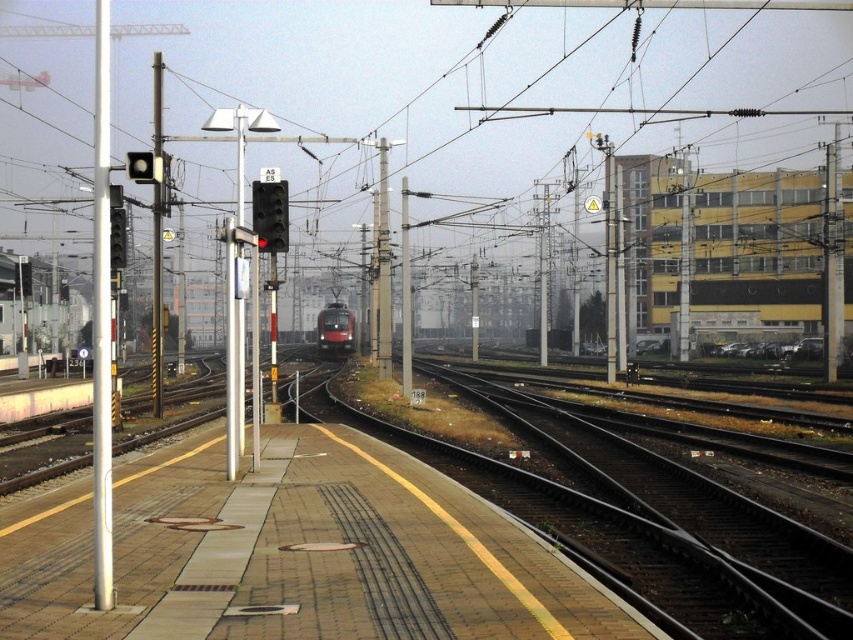
The height and width of the screenshot is (640, 853). I want to click on brick platform at center, so click(294, 554).

Is brick platform at center taller than metallic pole at center?

No.

This screenshot has width=853, height=640. I want to click on brick platform at center, so click(294, 554).

Is brick platform at center thinner than white metallic pole at left?

Indeed, brick platform at center has a lesser width compared to white metallic pole at left.

Between point (315, 538) and point (96, 564), which one is positioned behind?

The point (315, 538) is behind.

This screenshot has height=640, width=853. What do you see at coordinates (294, 554) in the screenshot? I see `brick platform at center` at bounding box center [294, 554].

In order to click on brick platform at center in this screenshot , I will do `click(294, 554)`.

Is point (97, 145) more distant than point (347, 330)?

No.

Between point (93, 170) and point (345, 321), which one is positioned in front?

Point (345, 321)

Where is `white metallic pole at left`? The image size is (853, 640). white metallic pole at left is located at coordinates (102, 321).